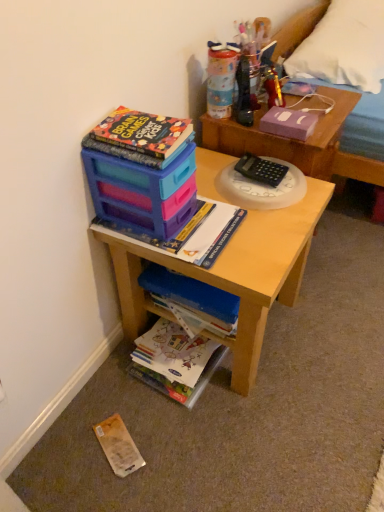
Where is `vacant point to the right of colored paper art at lower center, marked as the fourth book in a top-to-bottom arrangement`? This screenshot has height=512, width=384. vacant point to the right of colored paper art at lower center, marked as the fourth book in a top-to-bottom arrangement is located at coordinates (257, 380).